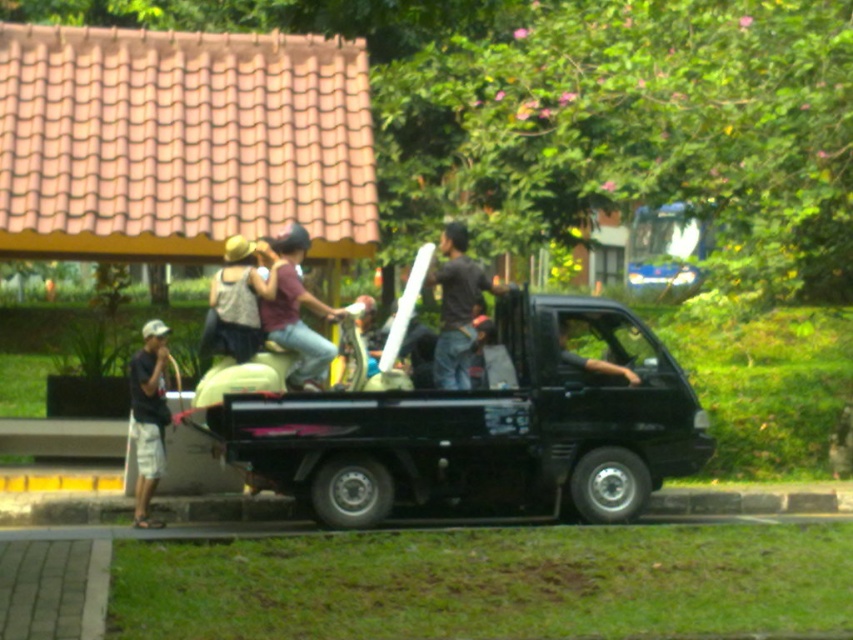
Question: Is dark gray shirt at center behind white cotton cap at left?

Choices:
 (A) no
 (B) yes

Answer: (B)

Question: Which point appears closest to the camera in this image?

Choices:
 (A) (134, 493)
 (B) (450, 269)

Answer: (B)

Question: Is black glossy pickup truck at center positioned before white cotton cap at left?

Choices:
 (A) no
 (B) yes

Answer: (B)

Question: Can you confirm if black glossy pickup truck at center is bigger than white cotton cap at left?

Choices:
 (A) no
 (B) yes

Answer: (B)

Question: Which object is the closest to the dark gray shirt at center?

Choices:
 (A) white cotton cap at left
 (B) black glossy pickup truck at center

Answer: (B)

Question: Which of the following is the farthest from the observer?

Choices:
 (A) dark gray shirt at center
 (B) black glossy pickup truck at center

Answer: (A)